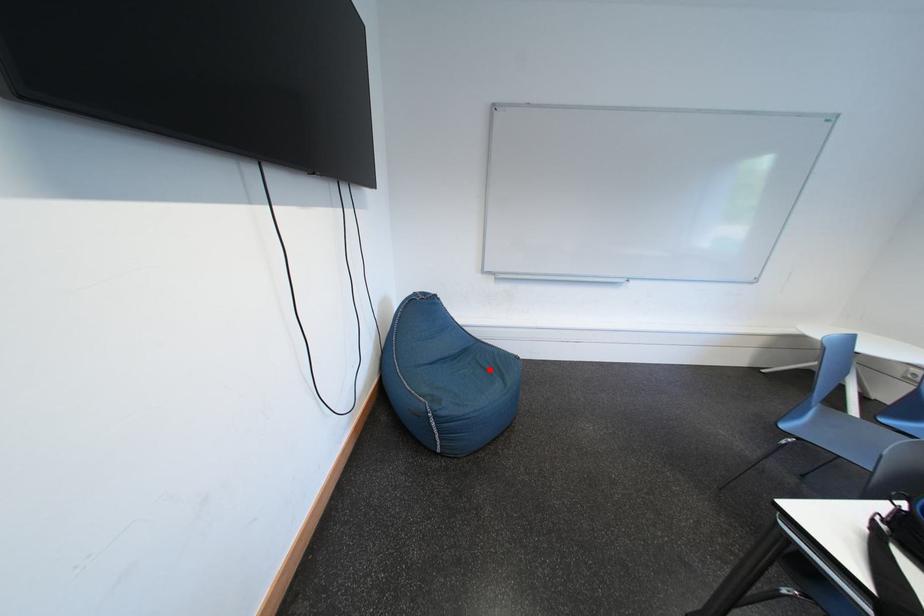
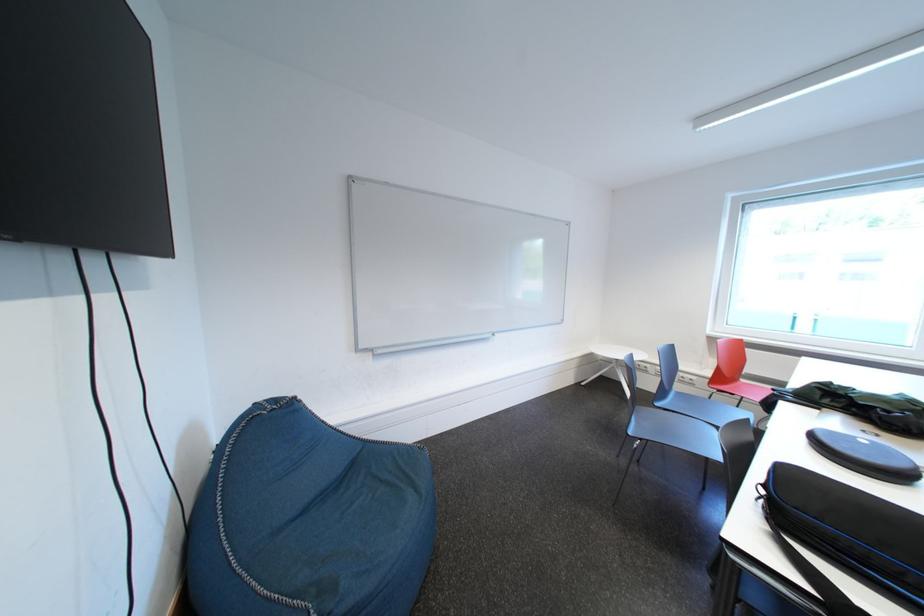
Question: I am providing you with two images of the same scene from different viewpoints. A red point is marked on the first image. At the location where the point appears in image 1, is it still visible in image 2?

Choices:
 (A) Yes
 (B) No

Answer: (A)